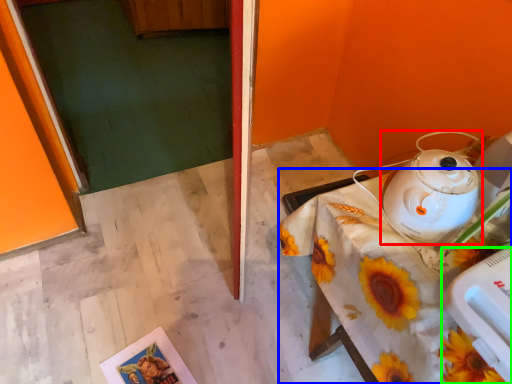
Question: Estimate the real-world distances between objects in this image. Which object is farther from kettle (highlighted by a red box), table (highlighted by a blue box) or appliance (highlighted by a green box)?

Choices:
 (A) table
 (B) appliance

Answer: (B)